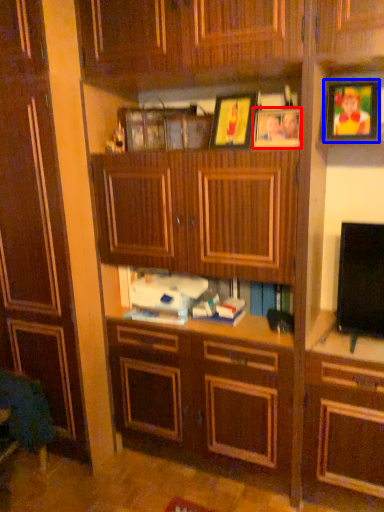
Question: Among these objects, which one is farthest to the camera, picture frame (highlighted by a red box) or picture frame (highlighted by a blue box)?

Choices:
 (A) picture frame
 (B) picture frame

Answer: (A)